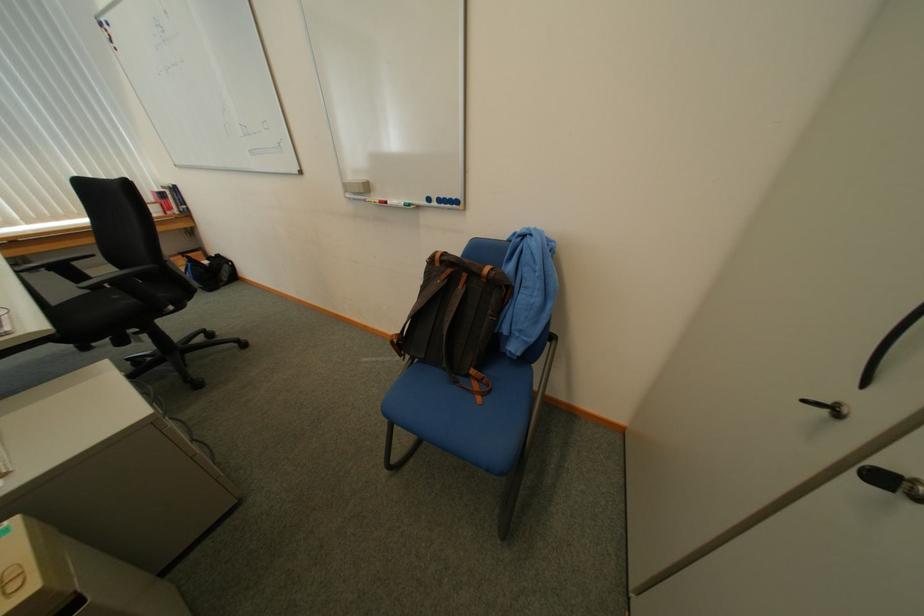
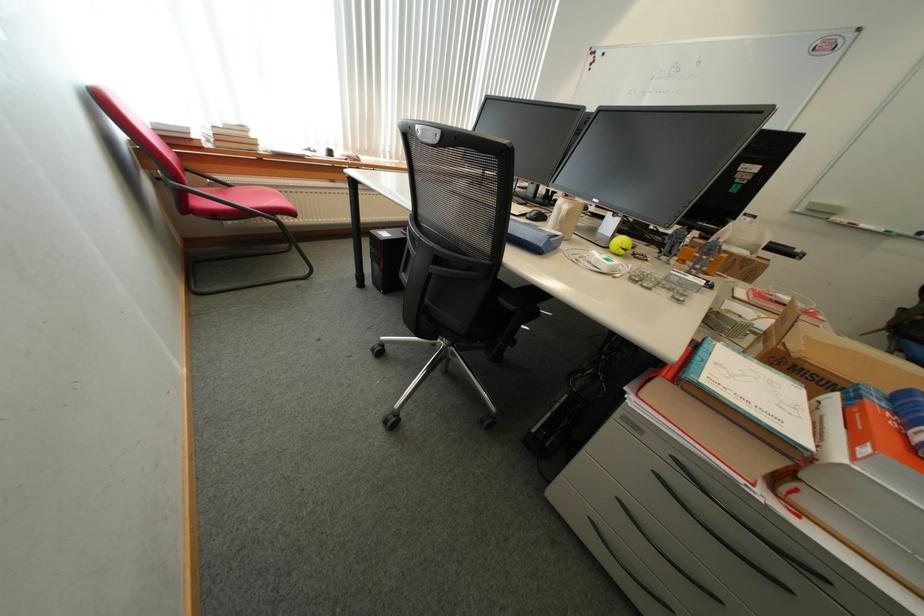
What movement of the cameraman would produce the second image?

The cameraman moved toward left, backward.